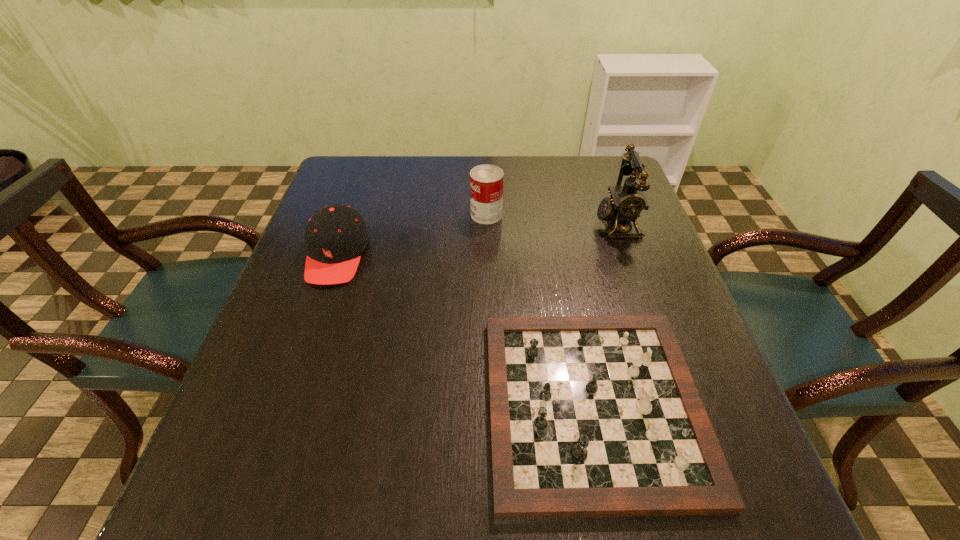
Image resolution: width=960 pixels, height=540 pixels. In order to click on vacant area that lies between the telephone and the shortest object in this screenshot , I will do `click(605, 314)`.

Find the location of a particular element. The height and width of the screenshot is (540, 960). empty space that is in between the telephone and the third tallest object is located at coordinates [x=477, y=239].

You are a GUI agent. You are given a task and a screenshot of the screen. Output one action in this format:
    pyautogui.click(x=<x>, y=<y>)
    Task: Click on the empty space between the can and the telephone
    
    Given the screenshot: What is the action you would take?
    pyautogui.click(x=552, y=219)

Where is `vacant space that's between the can and the nearest object`? vacant space that's between the can and the nearest object is located at coordinates (540, 310).

At what (x,y) coordinates should I click in order to perform the action: click on the closest object to the cap. Please return your answer as a coordinate pair (x, y). Looking at the image, I should click on (486, 181).

Identify which object is the second closest to the nearest object. Please provide its 2D coordinates. Your answer should be formatted as a tuple, i.e. [(x, y)], where the tuple contains the x and y coordinates of a point satisfying the conditions above.

[(336, 236)]

Where is `free spot that satisfies the following two spatial constraints: 1. on the front label of the third shortest object; 2. on the front-facing side of the second shortest object`? Image resolution: width=960 pixels, height=540 pixels. free spot that satisfies the following two spatial constraints: 1. on the front label of the third shortest object; 2. on the front-facing side of the second shortest object is located at coordinates (487, 255).

The image size is (960, 540). What are the coordinates of `free point that satisfies the following two spatial constraints: 1. on the front label of the third shortest object; 2. on the front-facing side of the third tallest object` in the screenshot? It's located at (487, 255).

Image resolution: width=960 pixels, height=540 pixels. Find the location of `free space that satisfies the following two spatial constraints: 1. on the front label of the can; 2. on the left side of the nearest object`. free space that satisfies the following two spatial constraints: 1. on the front label of the can; 2. on the left side of the nearest object is located at coordinates (490, 405).

Where is `vacant space that satisfies the following two spatial constraints: 1. on the front label of the third shortest object; 2. on the left side of the nearest object`? The width and height of the screenshot is (960, 540). vacant space that satisfies the following two spatial constraints: 1. on the front label of the third shortest object; 2. on the left side of the nearest object is located at coordinates (490, 405).